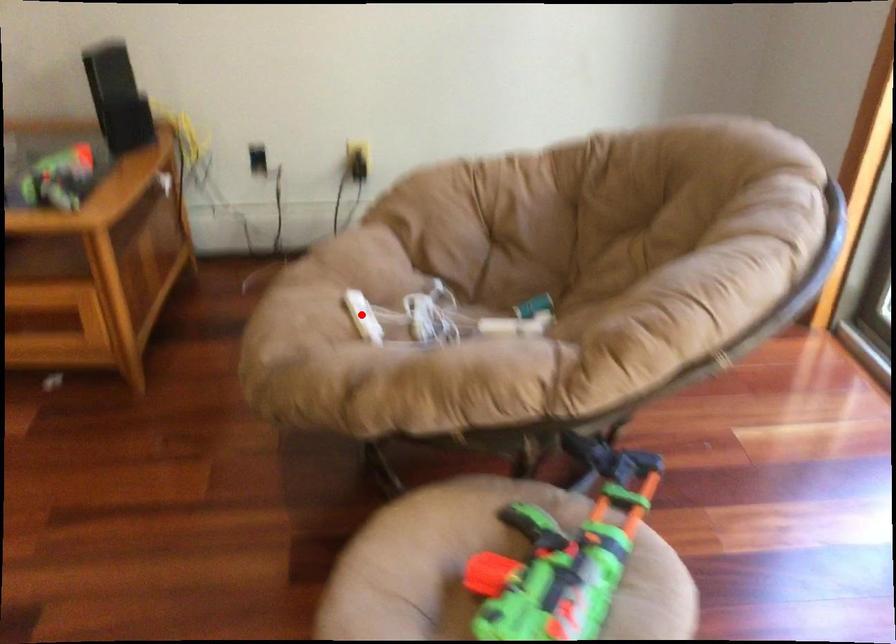
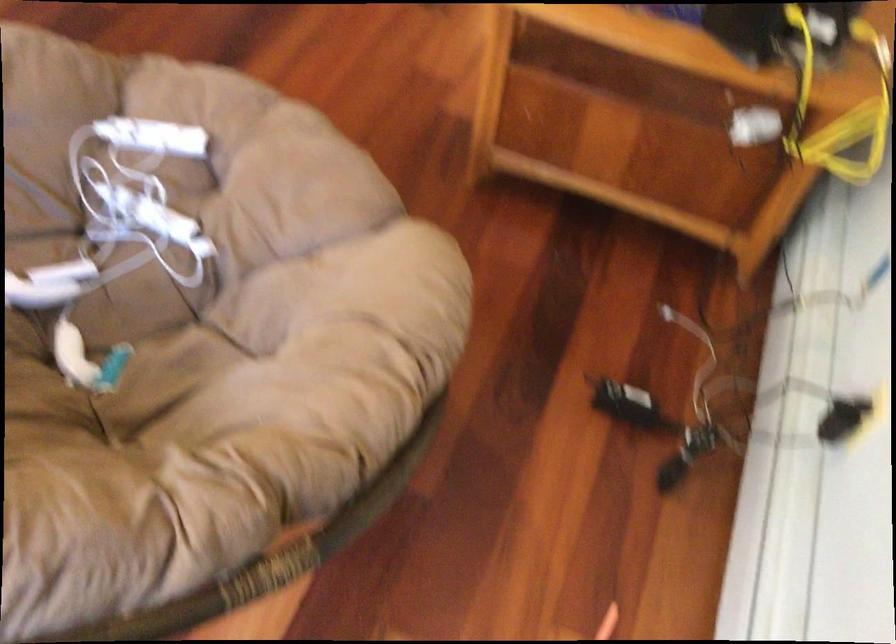
Question: I am providing you with two images of the same scene from different viewpoints. In image1, a red point is highlighted. Considering the same 3D point in image2, which of the following is correct?

Choices:
 (A) It is closer
 (B) It is farther

Answer: (A)